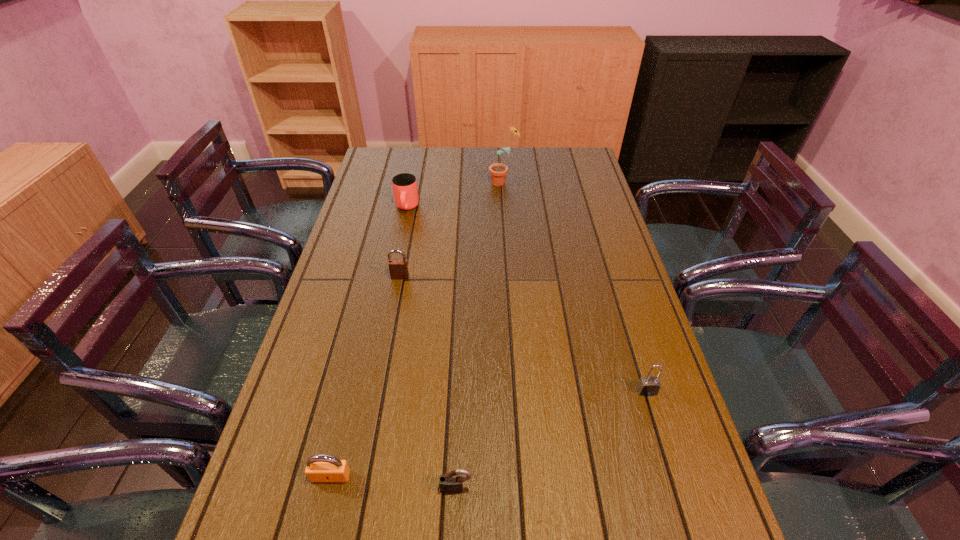
You are a GUI agent. You are given a task and a screenshot of the screen. Output one action in this format:
    pyautogui.click(x=<x>, y=<y>)
    Task: Click on the free point between the fourth nearest object and the second nearest padlock
    The width and height of the screenshot is (960, 540).
    Given the screenshot: What is the action you would take?
    pyautogui.click(x=366, y=376)

In order to click on free space between the cup and the rightmost padlock in this screenshot , I will do `click(527, 299)`.

Locate an element on the screen. free space between the tallest object and the fifth nearest object is located at coordinates (455, 195).

Locate an element on the screen. Image resolution: width=960 pixels, height=540 pixels. unoccupied area between the cup and the rightmost object is located at coordinates (527, 299).

Locate an element on the screen. The height and width of the screenshot is (540, 960). free spot between the second padlock from right to left and the farthest padlock is located at coordinates (428, 383).

Select which object appears as the second closest to the farthest padlock. Please provide its 2D coordinates. Your answer should be formatted as a tuple, i.e. [(x, y)], where the tuple contains the x and y coordinates of a point satisfying the conditions above.

[(498, 171)]

Point out which object is positioned as the second nearest to the sunflower. Please provide its 2D coordinates. Your answer should be formatted as a tuple, i.e. [(x, y)], where the tuple contains the x and y coordinates of a point satisfying the conditions above.

[(398, 268)]

This screenshot has height=540, width=960. Identify the location of the fourth closest padlock to the second farthest object. (451, 482).

Point out which padlock is positioned as the third nearest to the fifth nearest object. Please provide its 2D coordinates. Your answer should be formatted as a tuple, i.e. [(x, y)], where the tuple contains the x and y coordinates of a point satisfying the conditions above.

[(648, 386)]

Locate an element on the screen. The width and height of the screenshot is (960, 540). vacant space that satisfies the following two spatial constraints: 1. on the flower of the tallest object; 2. on the handle side of the cup is located at coordinates (506, 208).